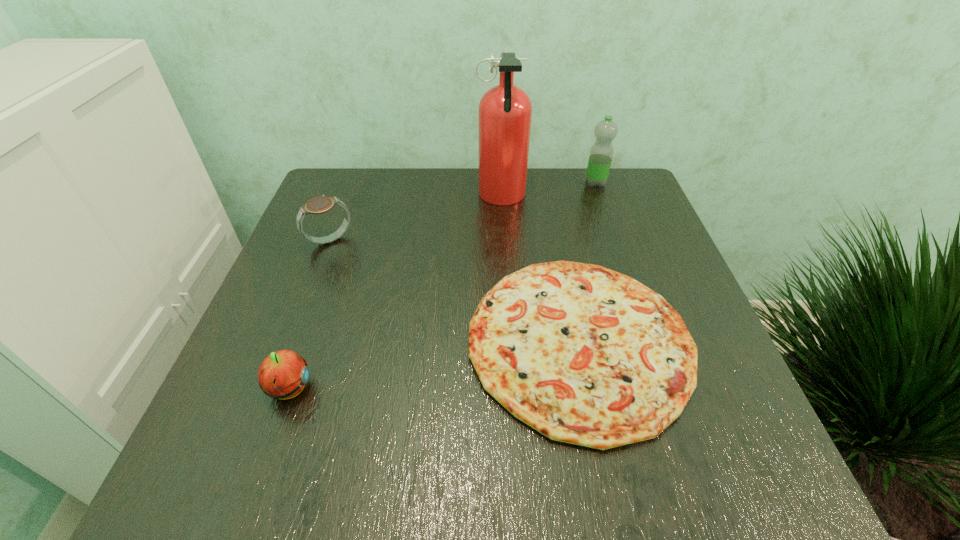
Identify the location of unoccupied area between the water bottle and the pizza. (588, 262).

Image resolution: width=960 pixels, height=540 pixels. What are the coordinates of `free space between the third farthest object and the second shortest object` in the screenshot? It's located at (309, 315).

Identify the location of vacant area that lies between the third nearest object and the fire extinguisher. The width and height of the screenshot is (960, 540). (416, 219).

Where is `vacant region between the apple and the watch`? Image resolution: width=960 pixels, height=540 pixels. vacant region between the apple and the watch is located at coordinates click(309, 315).

Locate an element on the screen. Image resolution: width=960 pixels, height=540 pixels. object that stands as the second closest to the pizza is located at coordinates (283, 374).

Identify which object is the fourth nearest to the shortest object. Please provide its 2D coordinates. Your answer should be formatted as a tuple, i.e. [(x, y)], where the tuple contains the x and y coordinates of a point satisfying the conditions above.

[(601, 153)]

Identify the location of free space that satisfies the following two spatial constraints: 1. on the back side of the second tallest object; 2. on the left side of the pizza. (548, 183).

In order to click on free space in the image that satisfies the following two spatial constraints: 1. on the back side of the second shortest object; 2. on the right side of the fire extinguisher in this screenshot , I will do `click(357, 198)`.